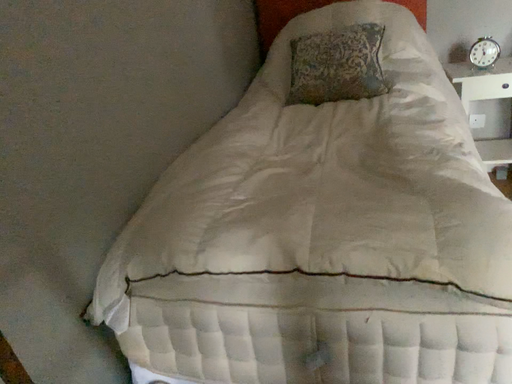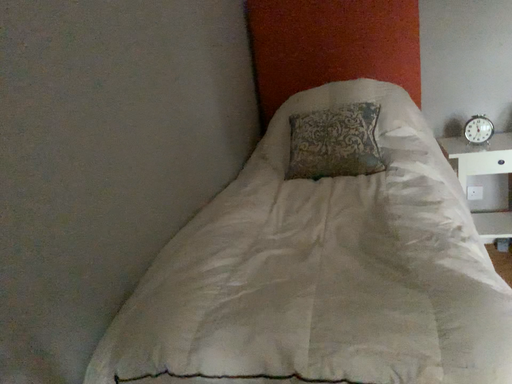
Question: How did the camera likely rotate when shooting the video?

Choices:
 (A) rotated downward
 (B) rotated upward

Answer: (B)